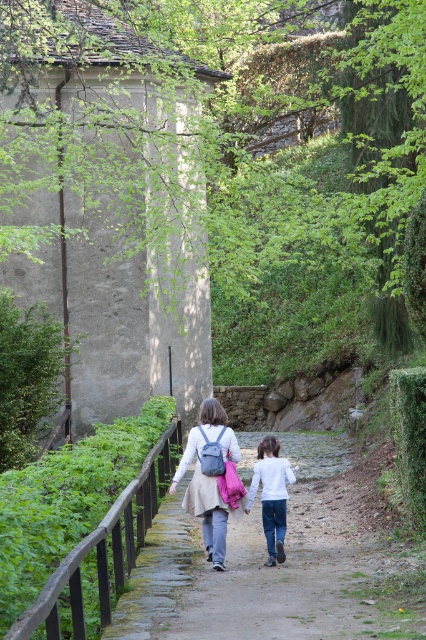
You are standing at the starting point of the cobblestone path and want to reach a destination located at point (259, 460). There is an obstacle at point (141, 570) that you must avoid. Which point should you approach first to ensure you can navigate around the obstacle safely?

You should approach point (141, 570) first because it is closer to you than point (259, 460), allowing you to navigate around the obstacle before proceeding to the destination.

You are a hiker who wants to ensure your backpack doesn t hit the wooden railing on the left while walking along the path. Given that your backpack is the matte blue backpack at center and you are wearing the white matte shirt at center, can you determine if your backpack will clear the wooden railing?

The matte blue backpack at center is much taller than the white matte shirt at center. Since the backpack is taller than the shirt, it is likely taller than the railing, so it might hit the wooden railing on the left if not adjusted properly.

You are one of the two people walking along the cobblestone path. You notice a matte blue backpack at center and a white matte shirt at center. Which object is closer to you as you walk forward?

The matte blue backpack at center is closer to you because it is in front of the white matte shirt at center.